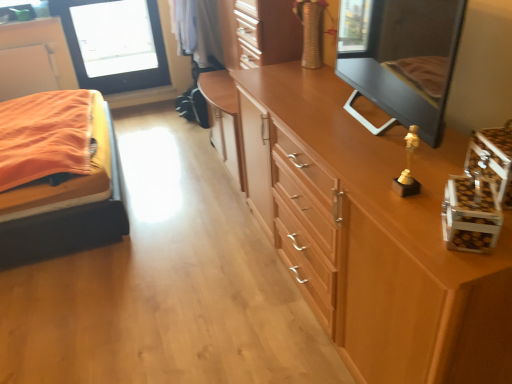
The height and width of the screenshot is (384, 512). Find the location of `empty space that is ontop of light brown wood chest of drawers at upper right (from a real-world perspective)`. empty space that is ontop of light brown wood chest of drawers at upper right (from a real-world perspective) is located at coordinates (366, 132).